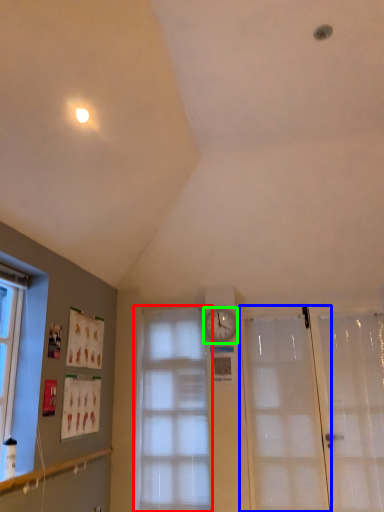
Question: Based on their relative distances, which object is farther from window (highlighted by a red box)? Choose from door (highlighted by a blue box) and clock (highlighted by a green box).

Choices:
 (A) door
 (B) clock

Answer: (A)